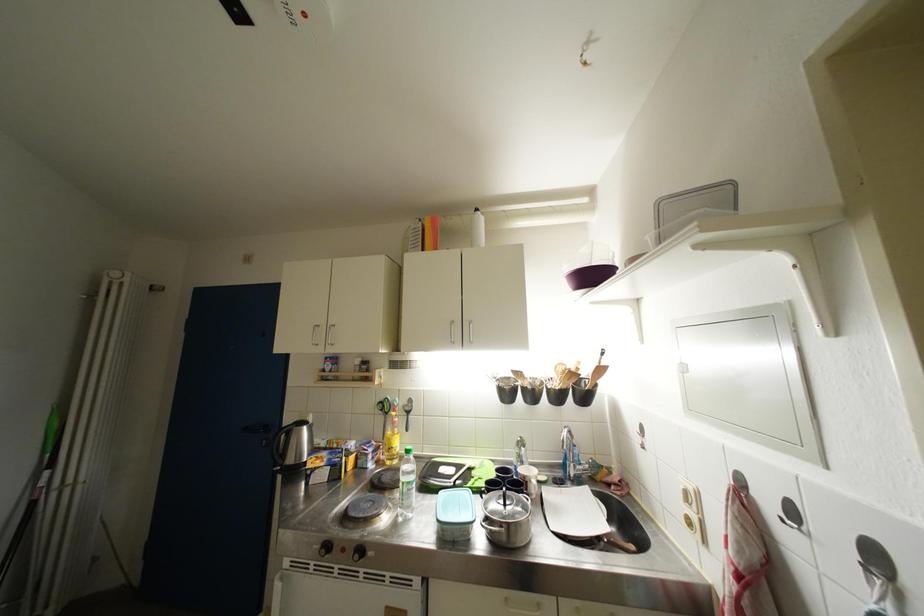
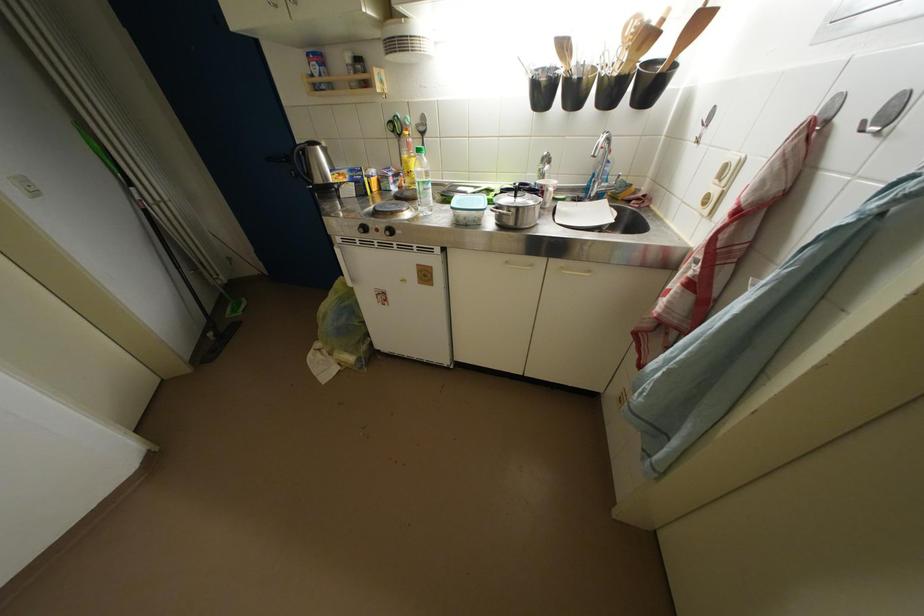
The point at (393, 418) is marked in the first image. Where is the corresponding point in the second image?

(407, 140)